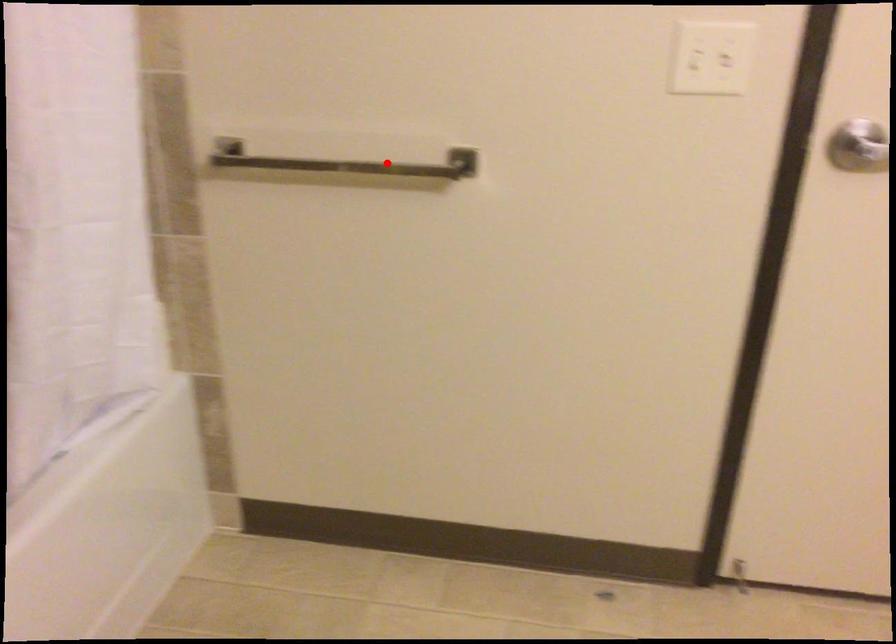
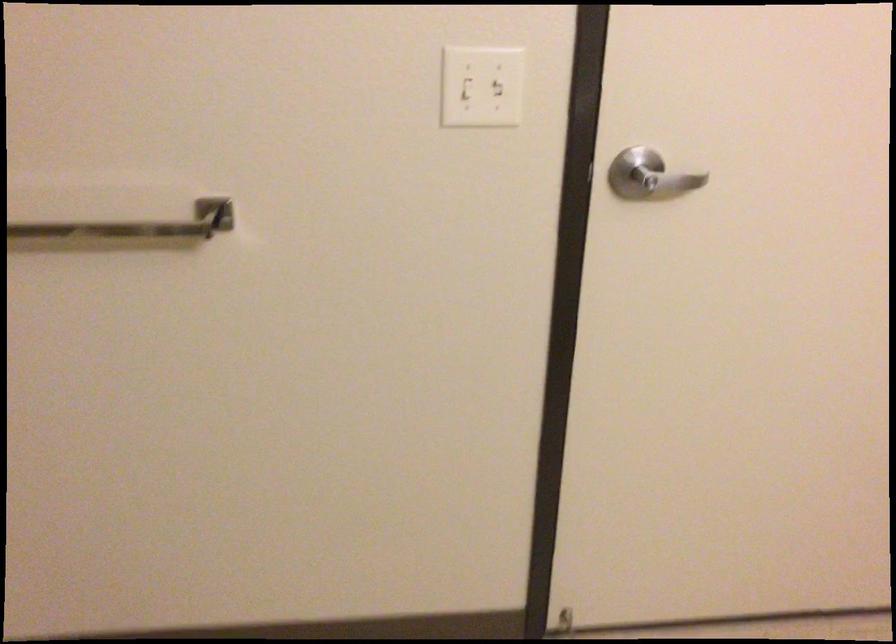
The point at the highlighted location is marked in the first image. Where is the corresponding point in the second image?

(125, 219)